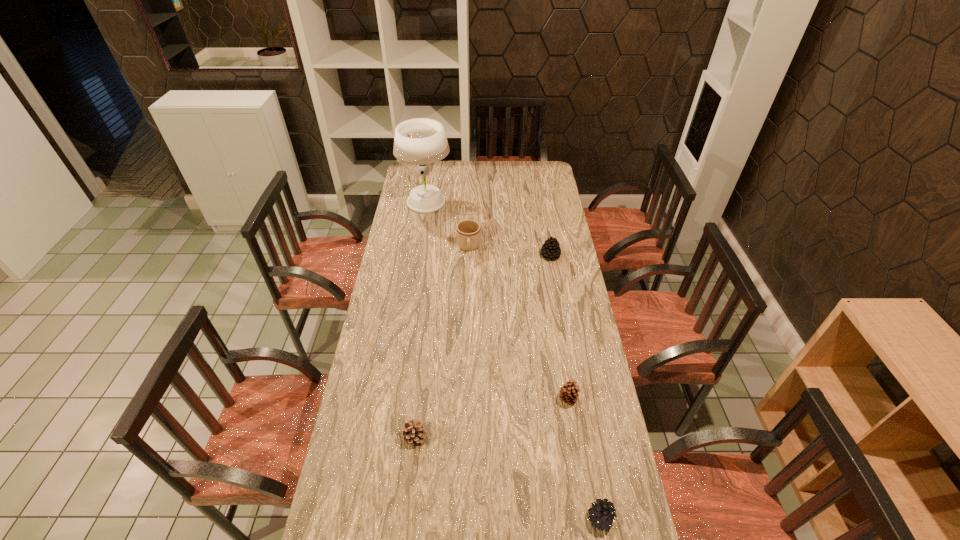
This screenshot has height=540, width=960. Identify the location of free spot located 0.270m at the narrow end of the farthest pinecone. (483, 255).

Locate an element on the screen. vacant space located at the narrow end of the farthest pinecone is located at coordinates (495, 255).

Locate an element on the screen. This screenshot has height=540, width=960. vacant space located 0.360m at the narrow end of the farthest pinecone is located at coordinates (464, 255).

Where is `vacant space positioned on the left of the fourth farthest object`? The width and height of the screenshot is (960, 540). vacant space positioned on the left of the fourth farthest object is located at coordinates (510, 399).

The width and height of the screenshot is (960, 540). Find the location of `vacant space located on the back of the nearest pinecone`. vacant space located on the back of the nearest pinecone is located at coordinates (591, 474).

Locate an element on the screen. vacant area situated 0.220m on the back of the third farthest pinecone is located at coordinates (421, 370).

Identify the location of object present at the left edge. (421, 141).

The height and width of the screenshot is (540, 960). In the image, there is a desktop. What are the coordinates of `blank space at the far edge` in the screenshot? It's located at (519, 173).

This screenshot has width=960, height=540. What are the coordinates of `free space at the left edge of the desktop` in the screenshot? It's located at (406, 193).

Find the location of `vacant area at the right edge of the desktop`. vacant area at the right edge of the desktop is located at coordinates click(x=603, y=403).